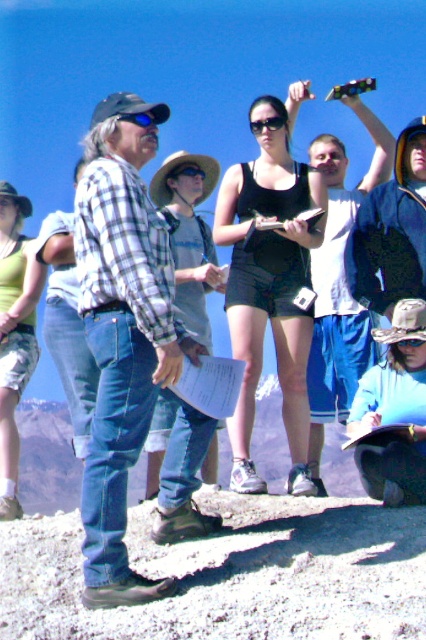
Find the location of a particular element. This screenshot has width=426, height=640. blue denim jeans at lower center is located at coordinates coord(394,412).

Does blue denim jeans at lower center have a smaller size compared to camouflage shorts at center?

Yes, blue denim jeans at lower center is smaller than camouflage shorts at center.

Measure the distance between point (400, 456) and camera.

They are 6.29 meters apart.

Identify the location of blue denim jeans at lower center. Image resolution: width=426 pixels, height=640 pixels. (394, 412).

Does black tank top at center have a smaller size compared to camouflage shorts at center?

Indeed, black tank top at center has a smaller size compared to camouflage shorts at center.

Does point (287, 333) come closer to viewer compared to point (0, 209)?

Yes, point (287, 333) is in front of point (0, 209).

Who is more distant from viewer, (232,266) or (29,323)?

Point (29,323)

Locate an element on the screen. This screenshot has width=426, height=640. black tank top at center is located at coordinates (270, 285).

Between black tank top at center and blue denim jeans at lower center, which one has more height?

blue denim jeans at lower center is taller.

Between black tank top at center and blue denim jeans at lower center, which one appears on the right side from the viewer's perspective?

blue denim jeans at lower center is more to the right.

Who is more distant from viewer, (241, 168) or (391, 460)?

The point (241, 168) is behind.

Identify the location of black tank top at center. The height and width of the screenshot is (640, 426). (270, 285).